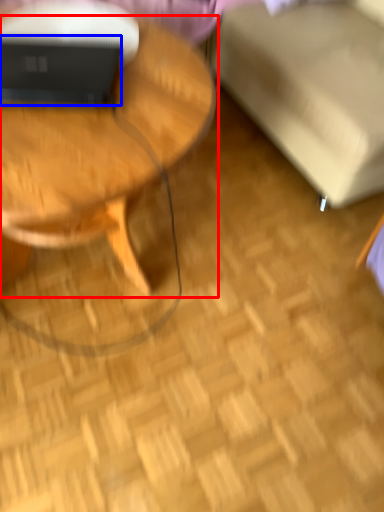
Question: Which point is closer to the camera, coffee table (highlighted by a red box) or laptop (highlighted by a blue box)?

Choices:
 (A) coffee table
 (B) laptop

Answer: (A)